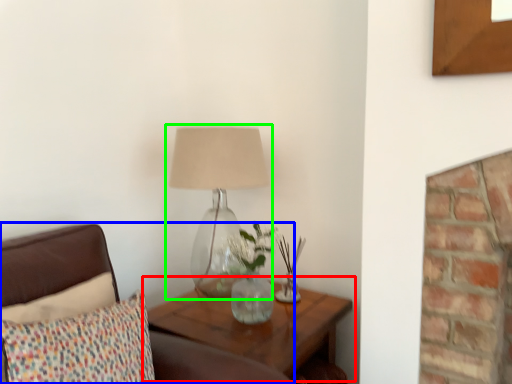
Question: Which is nearer to the table (highlighted by a red box)? furniture (highlighted by a blue box) or lamp (highlighted by a green box).

Choices:
 (A) furniture
 (B) lamp

Answer: (B)